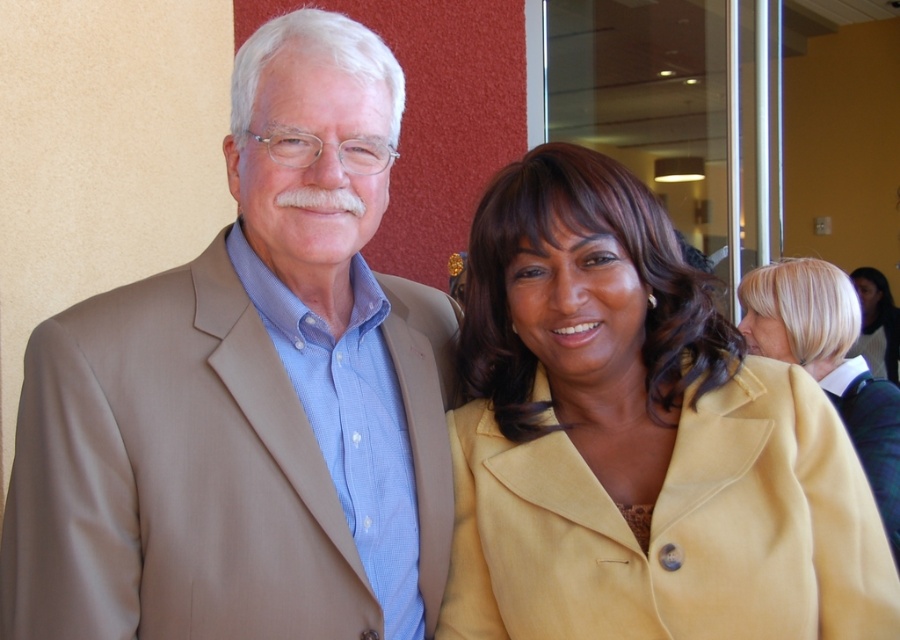
Does yellow suede jacket at center appear over blonde hair at upper right?

Incorrect, yellow suede jacket at center is not positioned above blonde hair at upper right.

Is point (842, 580) positioned after point (813, 308)?

No, it is in front of (813, 308).

Is point (555, 564) farther from viewer compared to point (767, 300)?

No, it is not.

You are a GUI agent. You are given a task and a screenshot of the screen. Output one action in this format:
    pyautogui.click(x=<x>, y=<y>)
    Task: Click on the yellow suede jacket at center
    The height and width of the screenshot is (640, 900).
    Given the screenshot: What is the action you would take?
    pyautogui.click(x=639, y=440)

Based on the photo, how much distance is there between yellow suede jacket at center and matte yellow coat at center?

A distance of 5.53 meters exists between yellow suede jacket at center and matte yellow coat at center.

Can you confirm if yellow suede jacket at center is shorter than matte yellow coat at center?

Yes, yellow suede jacket at center is shorter than matte yellow coat at center.

Who is more distant from viewer, (477,483) or (861,280)?

The point (861,280) is behind.

Locate an element on the screen. yellow suede jacket at center is located at coordinates (639, 440).

Who is more distant from viewer, (130, 612) or (795, 340)?

The point (795, 340) is more distant.

Is point (221, 394) less distant than point (876, 470)?

Yes, point (221, 394) is closer to viewer.

Locate an element on the screen. This screenshot has width=900, height=640. tan fabric suit at left is located at coordinates (248, 396).